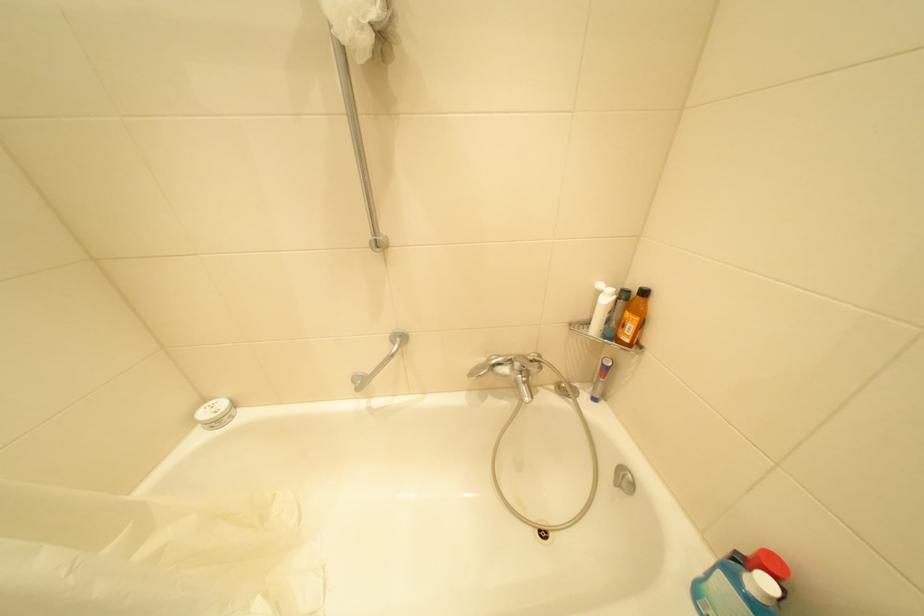
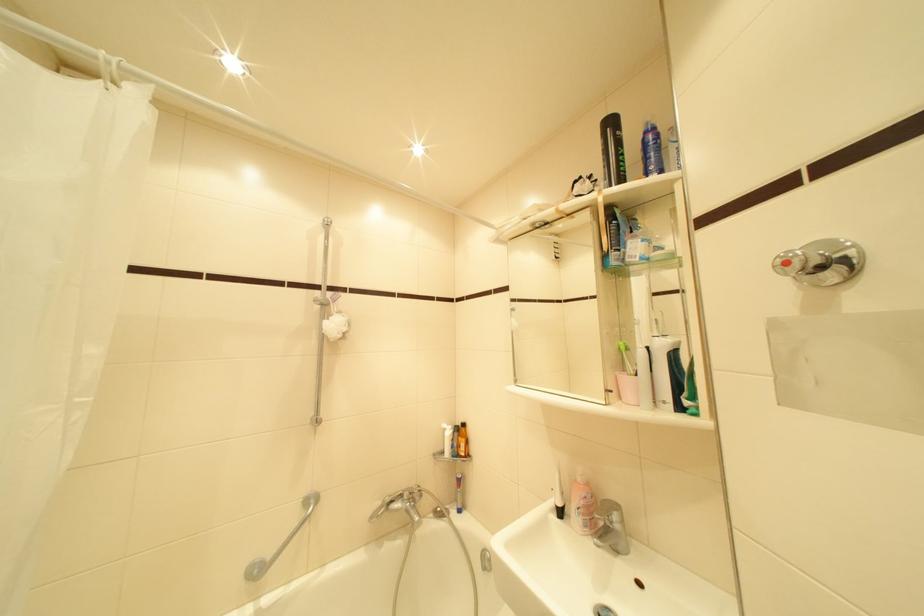
Where in the second image is the point corresponding to point 550,369 from the first image?

(430, 496)